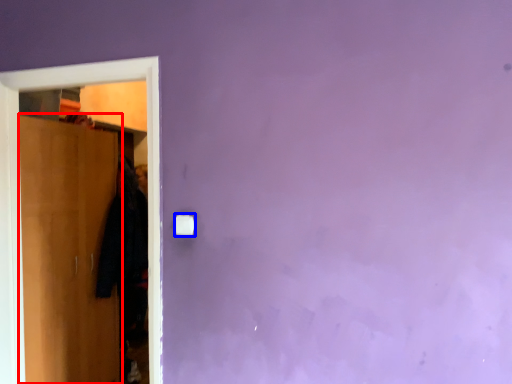
Question: Which object is closer to the camera taking this photo, door (highlighted by a red box) or light switch (highlighted by a blue box)?

Choices:
 (A) door
 (B) light switch

Answer: (B)